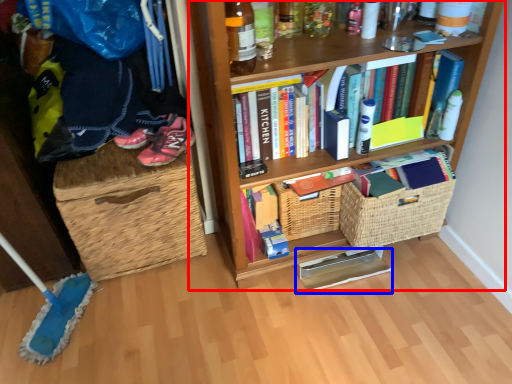
Question: Which object is further to the camera taking this photo, bookcase (highlighted by a red box) or book (highlighted by a blue box)?

Choices:
 (A) bookcase
 (B) book

Answer: (B)